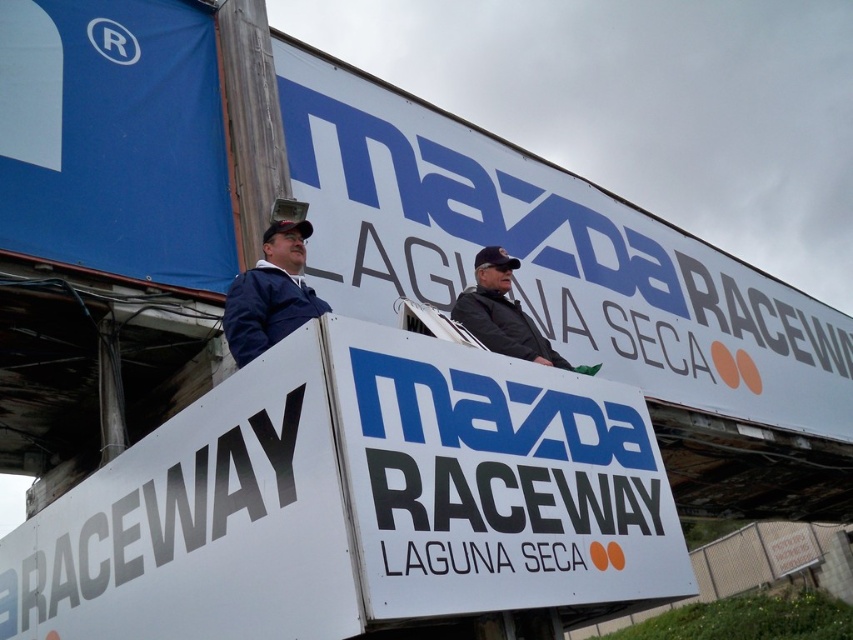
Question: Which object is positioned farthest from the white matte sign at center?

Choices:
 (A) black leather jacket at center
 (B) blue fabric jacket at upper left
 (C) blue fabric at upper left

Answer: (C)

Question: Which object is the farthest from the blue fabric at upper left?

Choices:
 (A) white matte sign at center
 (B) black leather jacket at center
 (C) white matte signboard at upper center

Answer: (A)

Question: Estimate the real-world distances between objects in this image. Which object is closer to the white matte sign at center?

Choices:
 (A) blue fabric at upper left
 (B) white plastic billboard at center
 (C) blue fabric jacket at upper left
 (D) black leather jacket at center

Answer: (D)

Question: Does blue fabric at upper left lie in front of black leather jacket at center?

Choices:
 (A) yes
 (B) no

Answer: (A)

Question: Can you confirm if white matte signboard at upper center is positioned to the right of black leather jacket at center?

Choices:
 (A) yes
 (B) no

Answer: (B)

Question: Does white matte signboard at upper center appear over blue fabric jacket at upper left?

Choices:
 (A) no
 (B) yes

Answer: (A)